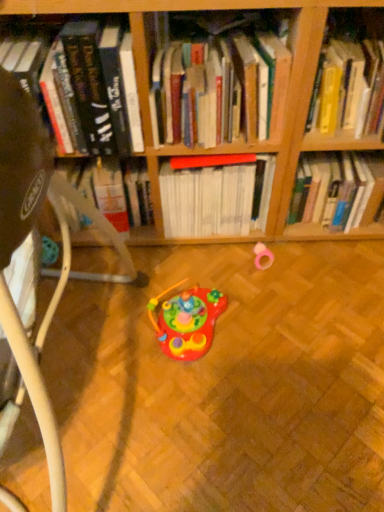
This screenshot has width=384, height=512. Find the location of `vacant space in front of pink rubber ring at center right, which is counted as the first toy, starting from the back`. vacant space in front of pink rubber ring at center right, which is counted as the first toy, starting from the back is located at coordinates (276, 298).